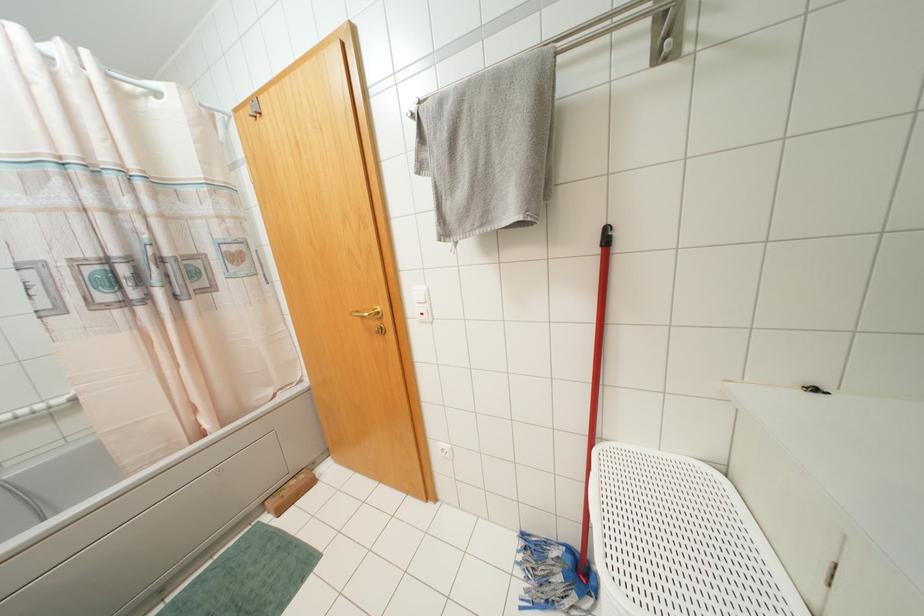
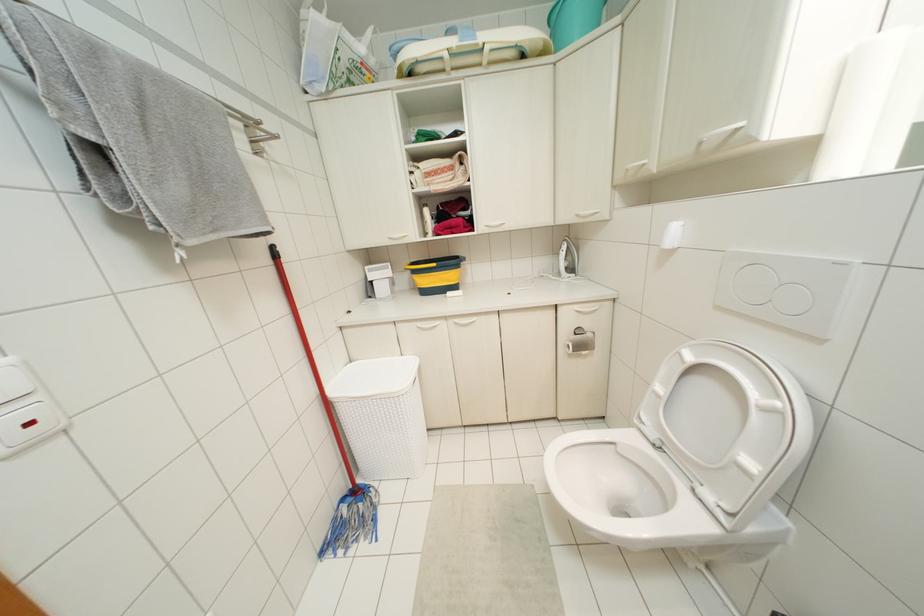
Looking at this image, the images are taken continuously from a first-person perspective. In which direction is your viewpoint rotating?

The rotation direction of the camera is right-down.